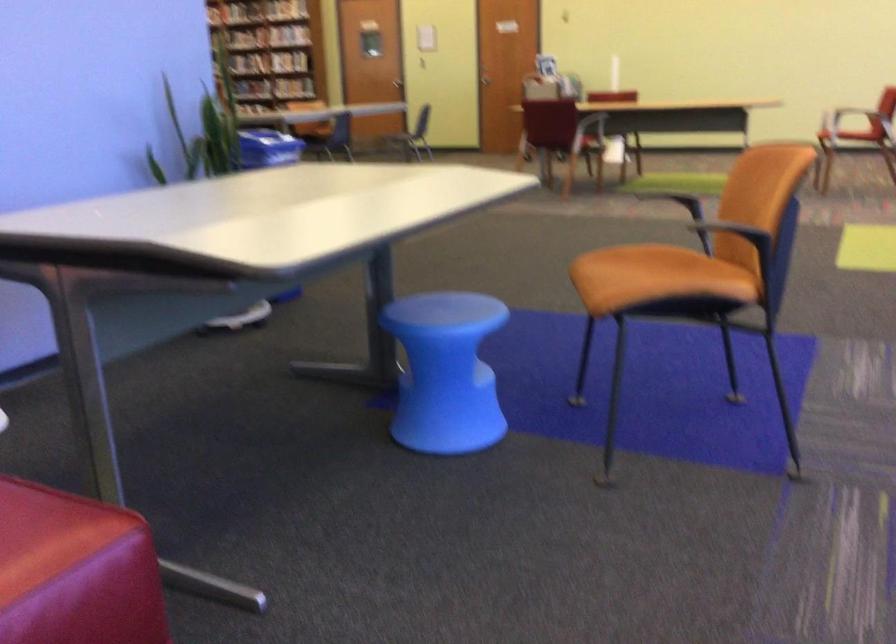
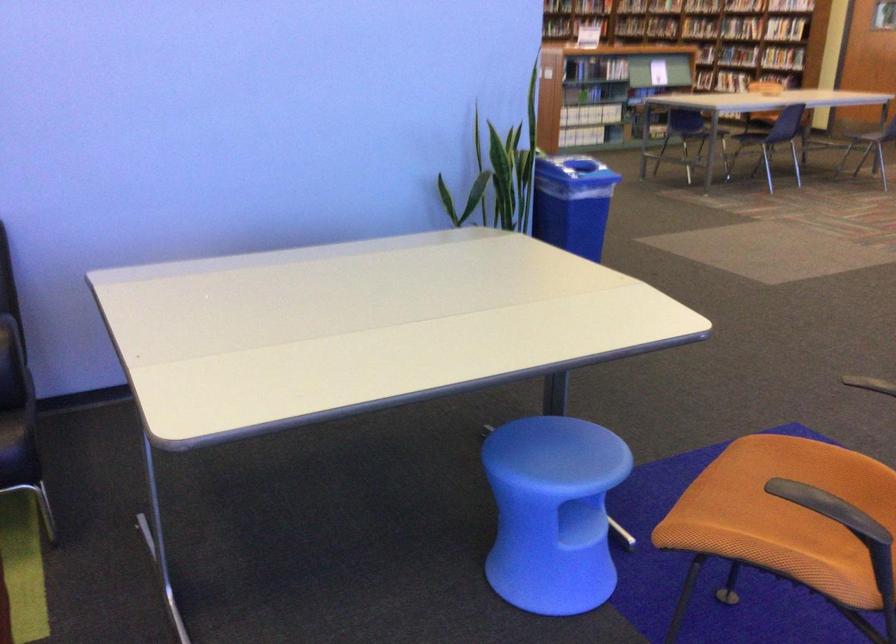
The point at (651, 278) is marked in the first image. Where is the corresponding point in the second image?

(785, 503)